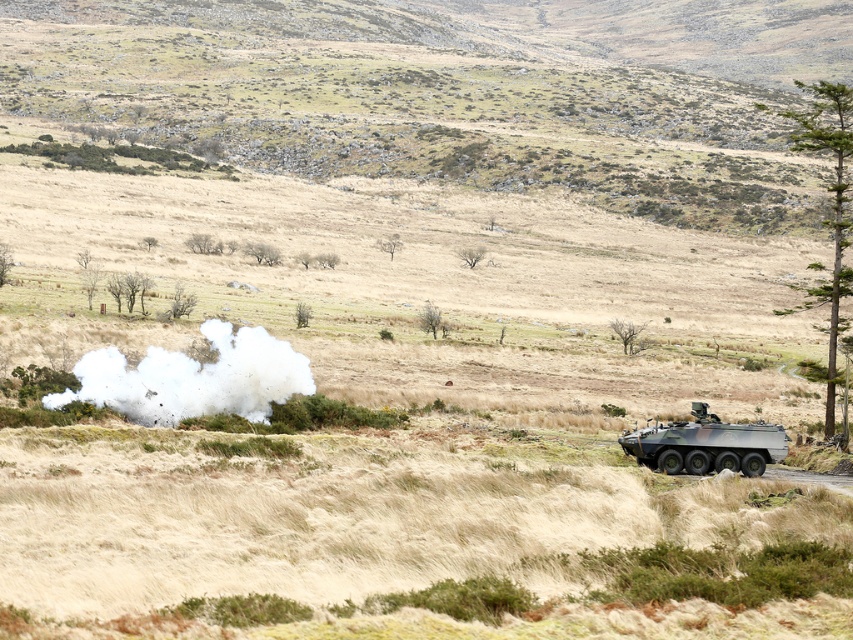
Question: Which of the following is the closest to the observer?

Choices:
 (A) (689, 426)
 (B) (180, 356)

Answer: (A)

Question: Does white fluffy cloud at left appear over camouflage fabric armored vehicle at right?

Choices:
 (A) yes
 (B) no

Answer: (A)

Question: Which of the following is the farthest from the observer?

Choices:
 (A) (103, 385)
 (B) (688, 422)

Answer: (A)

Question: Is white fluffy cloud at left thinner than camouflage fabric armored vehicle at right?

Choices:
 (A) no
 (B) yes

Answer: (A)

Question: Which point is farther from the camera taking this photo?

Choices:
 (A) (186, 385)
 (B) (730, 452)

Answer: (A)

Question: Does white fluffy cloud at left have a lesser width compared to camouflage fabric armored vehicle at right?

Choices:
 (A) yes
 (B) no

Answer: (B)